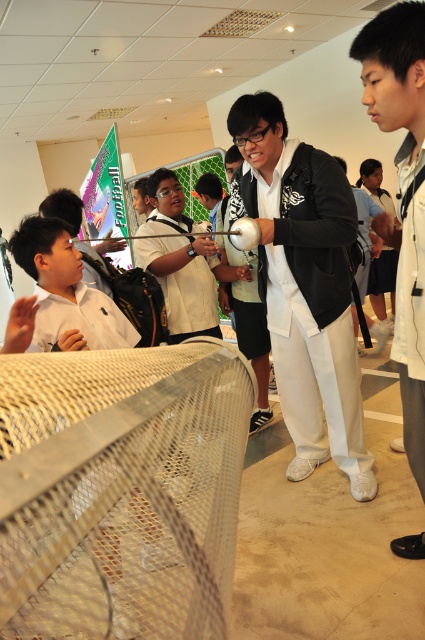
Question: Is metallic mesh tennis net at center bigger than black matte jacket at center?

Choices:
 (A) yes
 (B) no

Answer: (B)

Question: Does metallic mesh tennis net at center have a greater width compared to black matte jacket at center?

Choices:
 (A) yes
 (B) no

Answer: (B)

Question: Does metallic mesh tennis net at center appear on the left side of black matte jacket at center?

Choices:
 (A) yes
 (B) no

Answer: (A)

Question: Which of the following is the farthest from the observer?

Choices:
 (A) (314, 394)
 (B) (186, 636)

Answer: (A)